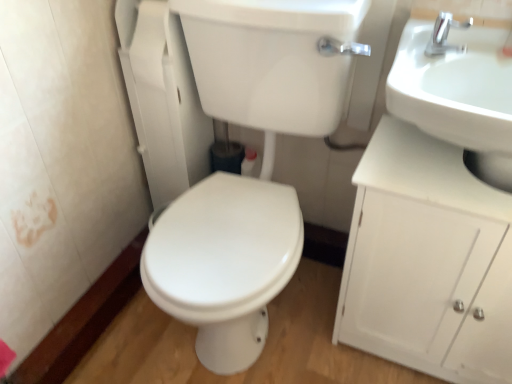
Measure the distance between white matte cabinet at right and camera.

white matte cabinet at right is 31.32 inches from camera.

Measure the distance between silver metallic faucet at upper right and camera.

90.20 centimeters.

Find the location of a particular element. white glossy sink at upper right is located at coordinates coord(457,92).

I want to click on white glossy sink at upper right, so click(248, 178).

Where is `white matte cabinet at right`? The width and height of the screenshot is (512, 384). white matte cabinet at right is located at coordinates point(426,261).

How many degrees apart are the facing directions of white glossy sink at upper right and silver metallic faucet at upper right?

There is a 2.5-degree angle between the facing directions of white glossy sink at upper right and silver metallic faucet at upper right.

Which point is more distant from viewer, (234, 260) or (446, 34)?

Positioned behind is point (234, 260).

From a real-world perspective, is white glossy sink at upper right on top of silver metallic faucet at upper right?

No, from a real-world perspective, white glossy sink at upper right is not on top of silver metallic faucet at upper right.

Which is more to the right, white glossy sink at upper right or silver metallic faucet at upper right?

silver metallic faucet at upper right.

Is point (438, 75) farther from viewer compared to point (465, 232)?

Yes, point (438, 75) is farther from viewer.

Is white glossy sink at upper right bigger or smaller than white matte cabinet at right?

Clearly, white glossy sink at upper right is smaller in size than white matte cabinet at right.

Does white glossy sink at upper right have a greater height compared to white matte cabinet at right?

No, white glossy sink at upper right is not taller than white matte cabinet at right.

Is white glossy sink at upper right further to camera compared to white matte cabinet at right?

No, white glossy sink at upper right is closer to the camera.

Is white matte cabinet at right inside or outside of white glossy sink at upper right?

white matte cabinet at right is spatially situated outside white glossy sink at upper right.

Are white matte cabinet at right and white glossy sink at upper right beside each other?

No, white matte cabinet at right is not with white glossy sink at upper right.

Does white matte cabinet at right have a larger size compared to white glossy sink at upper right?

No.

From the picture: Considering the sizes of white matte cabinet at right and white glossy sink at upper right in the image, is white matte cabinet at right taller or shorter than white glossy sink at upper right?

Considering their sizes, white matte cabinet at right has less height than white glossy sink at upper right.

In the scene shown: Is silver metallic faucet at upper right touching white glossy sink at upper right?

No, silver metallic faucet at upper right is not touching white glossy sink at upper right.

In the scene shown: Does silver metallic faucet at upper right have a greater height compared to white glossy sink at upper right?

Incorrect, the height of silver metallic faucet at upper right is not larger of that of white glossy sink at upper right.

From a real-world perspective, is silver metallic faucet at upper right on top of white glossy sink at upper right?

Yes, from a real-world perspective, silver metallic faucet at upper right is above white glossy sink at upper right.

Could white glossy sink at upper right be considered to be inside silver metallic faucet at upper right?

That's incorrect, white glossy sink at upper right is not inside silver metallic faucet at upper right.

In the scene shown: From the image's perspective, is white glossy sink at upper right under white matte cabinet at right?

No.

Between white glossy sink at upper right and white matte cabinet at right, which one appears on the right side from the viewer's perspective?

white matte cabinet at right.

Would you say white glossy sink at upper right is outside white matte cabinet at right?

white glossy sink at upper right lies outside white matte cabinet at right's area.

Are white glossy sink at upper right and white glossy sink at upper right beside each other?

No, white glossy sink at upper right is not touching white glossy sink at upper right.

From a real-world perspective, is white glossy sink at upper right physically above white glossy sink at upper right?

Correct, in the physical world, white glossy sink at upper right is higher than white glossy sink at upper right.

Is point (464, 53) behind point (243, 40)?

No.

Considering the positions of objects white glossy sink at upper right and white glossy sink at upper right in the image provided, who is more to the right, white glossy sink at upper right or white glossy sink at upper right?

Positioned to the right is white glossy sink at upper right.

In terms of size, does white glossy sink at upper right appear bigger or smaller than silver metallic faucet at upper right?

In the image, white glossy sink at upper right appears to be larger than silver metallic faucet at upper right.

How different are the orientations of white glossy sink at upper right and silver metallic faucet at upper right in degrees?

They differ by 3.28e-05 degrees in their facing directions.

Is silver metallic faucet at upper right completely or partially inside white glossy sink at upper right?

Absolutely, silver metallic faucet at upper right is inside white glossy sink at upper right.

Considering the sizes of objects white glossy sink at upper right and silver metallic faucet at upper right in the image provided, who is shorter, white glossy sink at upper right or silver metallic faucet at upper right?

Standing shorter between the two is silver metallic faucet at upper right.

This screenshot has width=512, height=384. What are the coordinates of `tap on the right side of white glossy sink at upper right` in the screenshot? It's located at (445, 35).

At what (x,y) coordinates should I click in order to perform the action: click on sink above the white matte cabinet at right (from the image's perspective). Please return your answer as a coordinate pair (x, y). The height and width of the screenshot is (384, 512). Looking at the image, I should click on (457, 92).

Looking at the image, which one is located further to white matte cabinet at right, silver metallic faucet at upper right or white glossy sink at upper right?

silver metallic faucet at upper right lies further to white matte cabinet at right than the other object.

Looking at the image, which one is located closer to white glossy sink at upper right, white matte cabinet at right or silver metallic faucet at upper right?

Among the two, white matte cabinet at right is located nearer to white glossy sink at upper right.

Which object lies further to the anchor point silver metallic faucet at upper right, white glossy sink at upper right or white glossy sink at upper right?

Among the two, white glossy sink at upper right is located further to silver metallic faucet at upper right.

From the image, which object appears to be nearer to silver metallic faucet at upper right, white matte cabinet at right or white glossy sink at upper right?

white glossy sink at upper right.

When comparing their distances from white glossy sink at upper right, does white glossy sink at upper right or white matte cabinet at right seem closer?

white glossy sink at upper right lies closer to white glossy sink at upper right than the other object.

Which object lies further to the anchor point silver metallic faucet at upper right, white glossy sink at upper right or white matte cabinet at right?

The object further to silver metallic faucet at upper right is white matte cabinet at right.

From the image, which object appears to be nearer to silver metallic faucet at upper right, white glossy sink at upper right or white glossy sink at upper right?

Among the two, white glossy sink at upper right is located nearer to silver metallic faucet at upper right.

Looking at this image, looking at the image, which one is located further to white glossy sink at upper right, silver metallic faucet at upper right or white matte cabinet at right?

The object further to white glossy sink at upper right is white matte cabinet at right.

Locate an element on the screen. Image resolution: width=512 pixels, height=384 pixels. tap located between white glossy sink at upper right and white glossy sink at upper right in the left-right direction is located at coordinates (445, 35).

At what (x,y) coordinates should I click in order to perform the action: click on tap situated between white glossy sink at upper right and white matte cabinet at right from left to right. Please return your answer as a coordinate pair (x, y). The width and height of the screenshot is (512, 384). Looking at the image, I should click on (445, 35).

I want to click on sink situated between white glossy sink at upper right and white matte cabinet at right from left to right, so click(457, 92).

This screenshot has height=384, width=512. I want to click on sink between silver metallic faucet at upper right and white matte cabinet at right in the vertical direction, so click(457, 92).